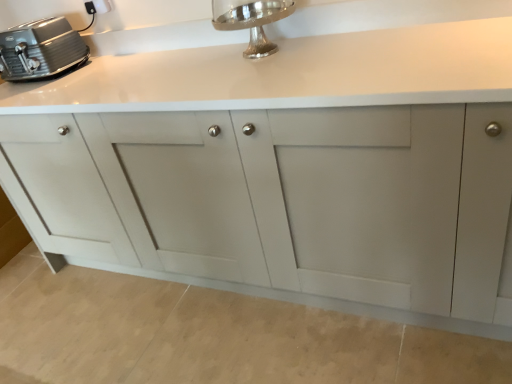
I want to click on satin silver toaster at upper left, so click(40, 49).

You are a GUI agent. You are given a task and a screenshot of the screen. Output one action in this format:
    pyautogui.click(x=<x>, y=<y>)
    Task: Click on the white plastic electric outlet at upper left
    This screenshot has height=384, width=512.
    Given the screenshot: What is the action you would take?
    pyautogui.click(x=97, y=6)

Is matte gray cabinet at center looking in the opposite direction of white plastic electric outlet at upper left?

No.

Does matte gray cabinet at center appear on the left side of white plastic electric outlet at upper left?

No.

From a real-world perspective, relative to white plastic electric outlet at upper left, is matte gray cabinet at center vertically above or below?

From a real-world perspective, matte gray cabinet at center is physically below white plastic electric outlet at upper left.

Which of these two, matte gray cabinet at center or white plastic electric outlet at upper left, stands shorter?

With less height is white plastic electric outlet at upper left.

Is silver polished faucet at upper center oriented towards white plastic electric outlet at upper left?

No, silver polished faucet at upper center is not turned towards white plastic electric outlet at upper left.

Measure the distance from silver polished faucet at upper center to white plastic electric outlet at upper left.

They are 74.61 centimeters apart.

From the picture: From a real-world perspective, is silver polished faucet at upper center located higher than white plastic electric outlet at upper left?

No, from a real-world perspective, silver polished faucet at upper center is not above white plastic electric outlet at upper left.

From the picture: What's the angular difference between silver polished faucet at upper center and white plastic electric outlet at upper left's facing directions?

The angular difference between silver polished faucet at upper center and white plastic electric outlet at upper left is 0.00266 degrees.

Where is `electric outlet on the right of satin silver toaster at upper left`? electric outlet on the right of satin silver toaster at upper left is located at coordinates (97, 6).

Does point (102, 1) come behind point (18, 67)?

Yes, it is behind point (18, 67).

In terms of width, does white plastic electric outlet at upper left look wider or thinner when compared to satin silver toaster at upper left?

Considering their sizes, white plastic electric outlet at upper left looks slimmer than satin silver toaster at upper left.

Considering the relative sizes of white plastic electric outlet at upper left and satin silver toaster at upper left in the image provided, is white plastic electric outlet at upper left shorter than satin silver toaster at upper left?

A: Yes.

Choose the correct answer: Is white plastic electric outlet at upper left inside silver polished faucet at upper center or outside it?

white plastic electric outlet at upper left exists outside the volume of silver polished faucet at upper center.

Which object is further away from the camera taking this photo, white plastic electric outlet at upper left or silver polished faucet at upper center?

Positioned behind is white plastic electric outlet at upper left.

Which is more to the left, white plastic electric outlet at upper left or silver polished faucet at upper center?

white plastic electric outlet at upper left is more to the left.

Is white plastic electric outlet at upper left bigger or smaller than silver polished faucet at upper center?

Considering their sizes, white plastic electric outlet at upper left takes up less space than silver polished faucet at upper center.

Which is correct: satin silver toaster at upper left is inside matte gray cabinet at center, or outside of it?

satin silver toaster at upper left fits inside matte gray cabinet at center.

Considering the sizes of objects satin silver toaster at upper left and matte gray cabinet at center in the image provided, who is thinner, satin silver toaster at upper left or matte gray cabinet at center?

With smaller width is satin silver toaster at upper left.

From a real-world perspective, who is located higher, satin silver toaster at upper left or matte gray cabinet at center?

In real-world perspective, satin silver toaster at upper left is above.

From the image's perspective, would you say satin silver toaster at upper left is positioned over matte gray cabinet at center?

Indeed, from the image's perspective, satin silver toaster at upper left is shown above matte gray cabinet at center.

Considering their positions, is silver polished faucet at upper center located in front of or behind matte gray cabinet at center?

Visually, silver polished faucet at upper center is located behind matte gray cabinet at center.

Is silver polished faucet at upper center wider than matte gray cabinet at center?

No, silver polished faucet at upper center is not wider than matte gray cabinet at center.

From the image's perspective, who appears lower, silver polished faucet at upper center or matte gray cabinet at center?

From the image's view, matte gray cabinet at center is below.

Between silver polished faucet at upper center and matte gray cabinet at center, which one has larger size?

matte gray cabinet at center is bigger.

Can you see silver polished faucet at upper center touching satin silver toaster at upper left?

No, silver polished faucet at upper center is not beside satin silver toaster at upper left.

In the scene shown: From the image's perspective, is silver polished faucet at upper center over satin silver toaster at upper left?

Incorrect, from the image's perspective, silver polished faucet at upper center is lower than satin silver toaster at upper left.

Can you confirm if silver polished faucet at upper center is thinner than satin silver toaster at upper left?

Incorrect, the width of silver polished faucet at upper center is not less than that of satin silver toaster at upper left.

Based on the photo, is satin silver toaster at upper left a part of silver polished faucet at upper center?

No, satin silver toaster at upper left is located outside of silver polished faucet at upper center.

Identify the location of electric outlet positioned vertically above the matte gray cabinet at center (from a real-world perspective). (97, 6).

Find the location of a particular element. The width and height of the screenshot is (512, 384). faucet that is under the white plastic electric outlet at upper left (from a real-world perspective) is located at coordinates (251, 21).

Looking at the image, which one is located further to satin silver toaster at upper left, matte gray cabinet at center or silver polished faucet at upper center?

silver polished faucet at upper center is positioned further to the anchor satin silver toaster at upper left.

When comparing their distances from silver polished faucet at upper center, does satin silver toaster at upper left or matte gray cabinet at center seem closer?

matte gray cabinet at center.

From the image, which object appears to be farther from satin silver toaster at upper left, silver polished faucet at upper center or white plastic electric outlet at upper left?

The object further to satin silver toaster at upper left is silver polished faucet at upper center.

Based on their spatial positions, is silver polished faucet at upper center or satin silver toaster at upper left further from matte gray cabinet at center?

satin silver toaster at upper left.

When comparing their distances from white plastic electric outlet at upper left, does silver polished faucet at upper center or matte gray cabinet at center seem further?

Among the two, matte gray cabinet at center is located further to white plastic electric outlet at upper left.

From the image, which object appears to be farther from silver polished faucet at upper center, satin silver toaster at upper left or white plastic electric outlet at upper left?

Based on the image, satin silver toaster at upper left appears to be further to silver polished faucet at upper center.

Considering their positions, is silver polished faucet at upper center positioned further to satin silver toaster at upper left than matte gray cabinet at center?

silver polished faucet at upper center lies further to satin silver toaster at upper left than the other object.

Based on their spatial positions, is satin silver toaster at upper left or white plastic electric outlet at upper left closer to matte gray cabinet at center?

satin silver toaster at upper left is positioned closer to the anchor matte gray cabinet at center.

In order to click on faucet positioned between matte gray cabinet at center and white plastic electric outlet at upper left from near to far in this screenshot , I will do `click(251, 21)`.

Locate an element on the screen. This screenshot has height=384, width=512. cabinetry between satin silver toaster at upper left and silver polished faucet at upper center in the horizontal direction is located at coordinates (283, 199).

Image resolution: width=512 pixels, height=384 pixels. I want to click on home appliance between matte gray cabinet at center and white plastic electric outlet at upper left along the z-axis, so click(x=40, y=49).

The width and height of the screenshot is (512, 384). Find the location of `electric outlet between satin silver toaster at upper left and silver polished faucet at upper center from left to right`. electric outlet between satin silver toaster at upper left and silver polished faucet at upper center from left to right is located at coordinates (97, 6).